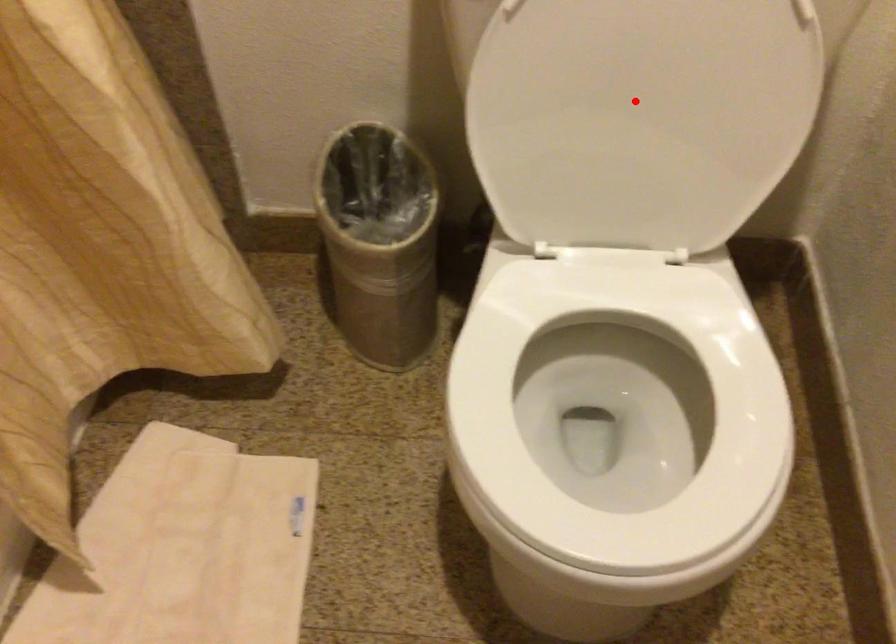
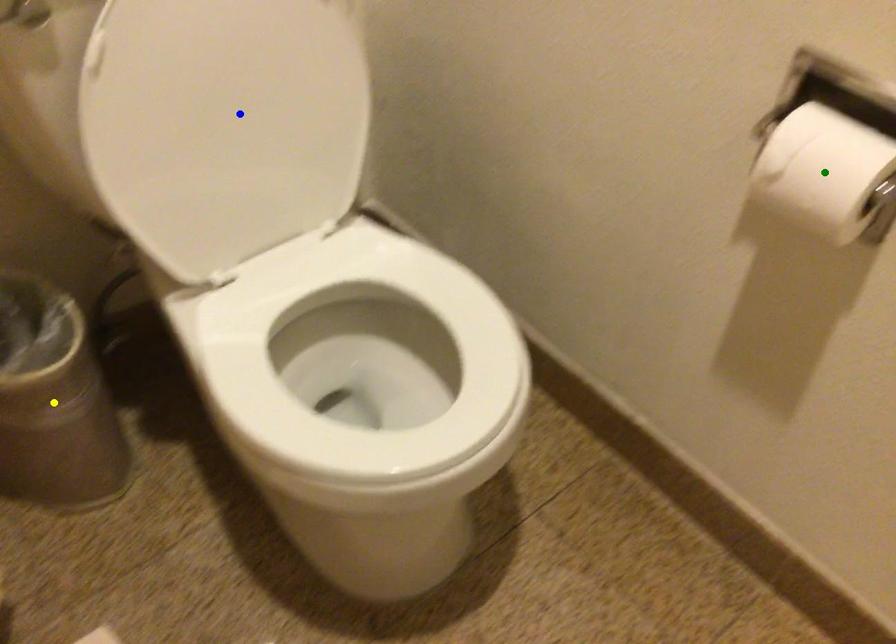
Question: I am providing you with two images of the same scene from different viewpoints. A red point is marked on the first image. You are given multiple points on the second image. Which point in image 2 is actually the same real-world point as the red point in image 1?

Choices:
 (A) yellow point
 (B) green point
 (C) blue point

Answer: (C)